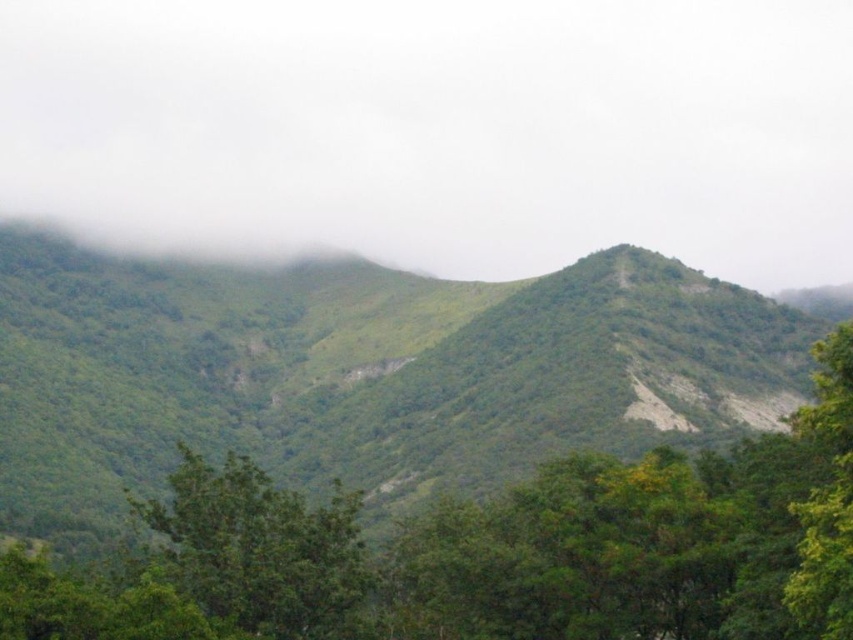
You are planning to plant a new tree in the mountain area. Considering the space available between the green leafy hill at center and the green leafy tree at center, which one has more horizontal space to accommodate the new tree?

The green leafy hill at center has a greater width than the green leafy tree at center, so it offers more horizontal space to accommodate the new tree.

You are an airplane pilot flying over the mountainous landscape. You notice the white fluffy cloud at upper center and the green leafy hill at center. Which object is higher in the sky?

The white fluffy cloud at upper center is much taller than the green leafy hill at center, so the white fluffy cloud at upper center is higher in the sky.

You are an observer standing at the base of the green leafy tree at center. Looking up, do you see the white fluffy cloud at upper center above the tree?

Yes, the white fluffy cloud at upper center is taller than the green leafy tree at center, so it appears above the tree.